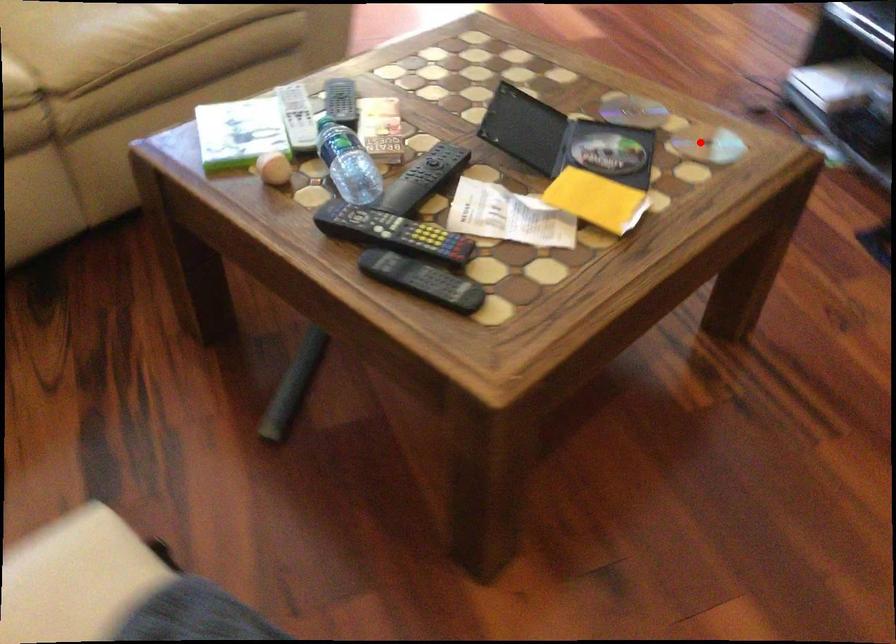
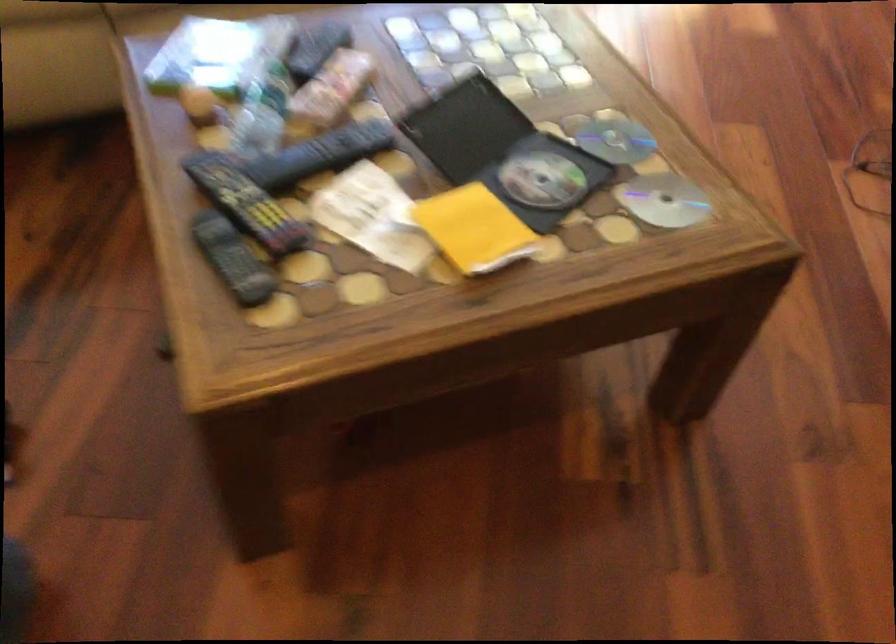
Question: I am providing you with two images of the same scene from different viewpoints. A red point is shown in image1. For the corresponding object point in image2, is it positioned nearer or farther from the camera?

Choices:
 (A) Nearer
 (B) Farther

Answer: (A)